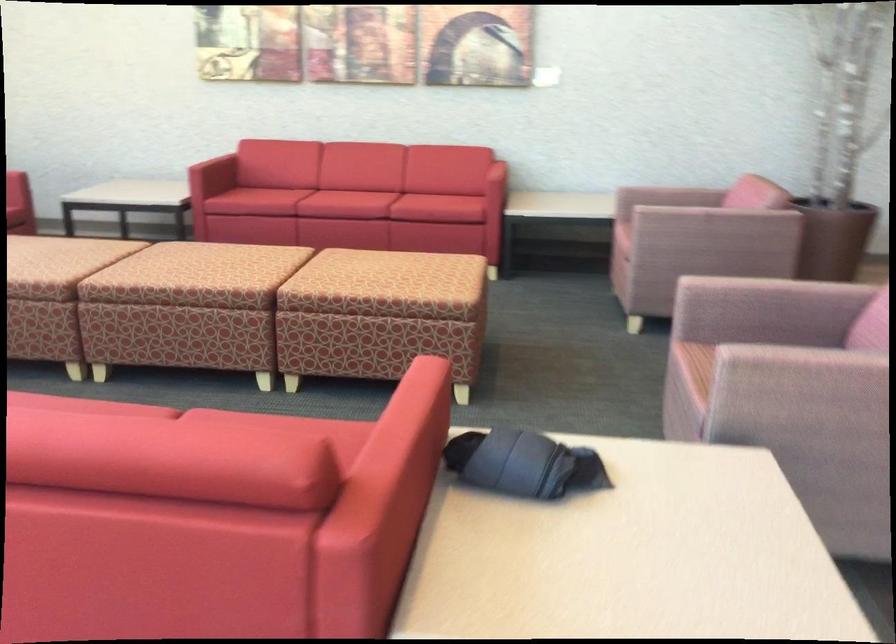
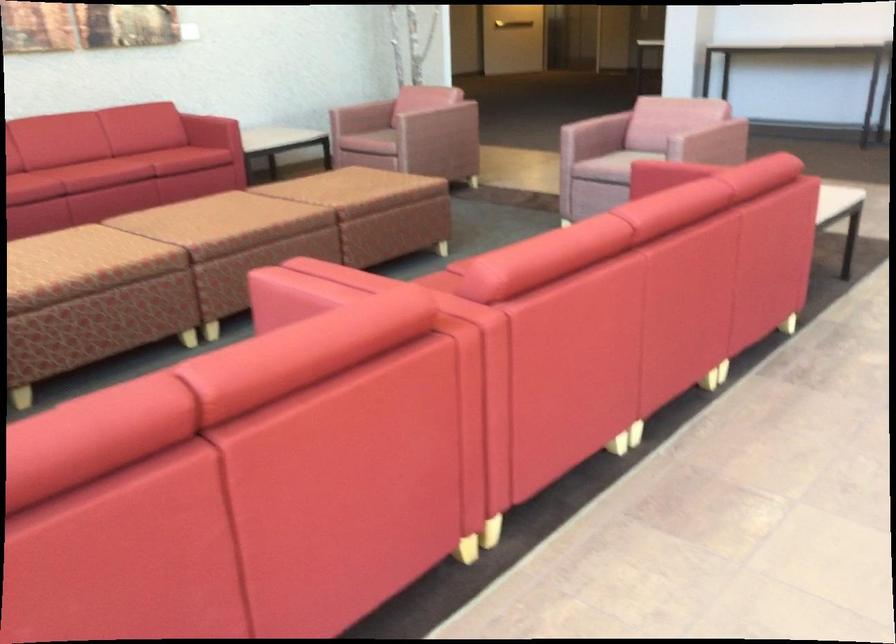
Locate, in the second image, the point that corresponds to point (300, 301) in the first image.

(380, 212)